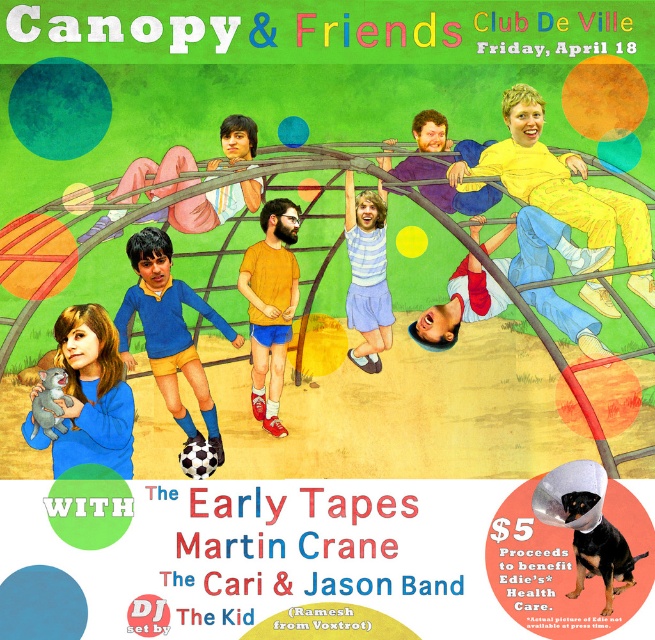
Does yellow matte pants at upper right have a smaller size compared to blue jersey at center?

Correct, yellow matte pants at upper right occupies less space than blue jersey at center.

Who is more distant from viewer, (x=531, y=109) or (x=196, y=378)?

Point (x=196, y=378)

Which is in front, point (508, 88) or point (162, 316)?

Positioned in front is point (162, 316).

At what (x,y) coordinates should I click in order to perform the action: click on yellow matte pants at upper right. Please return your answer as a coordinate pair (x, y). This screenshot has width=655, height=640. Looking at the image, I should click on (555, 180).

Is yellow matte pants at upper right to the right of white cotton shirt at center from the viewer's perspective?

Correct, you'll find yellow matte pants at upper right to the right of white cotton shirt at center.

Who is more distant from viewer, (563, 214) or (489, 241)?

Point (489, 241)

Image resolution: width=655 pixels, height=640 pixels. I want to click on yellow matte pants at upper right, so click(555, 180).

Which is in front, point (381, 166) or point (468, 157)?

Positioned in front is point (381, 166).

Who is shorter, striped fabric shirt at center or blue fabric shirt at center?

striped fabric shirt at center is shorter.

Image resolution: width=655 pixels, height=640 pixels. What are the coordinates of `striped fabric shirt at center` in the screenshot? It's located at (365, 234).